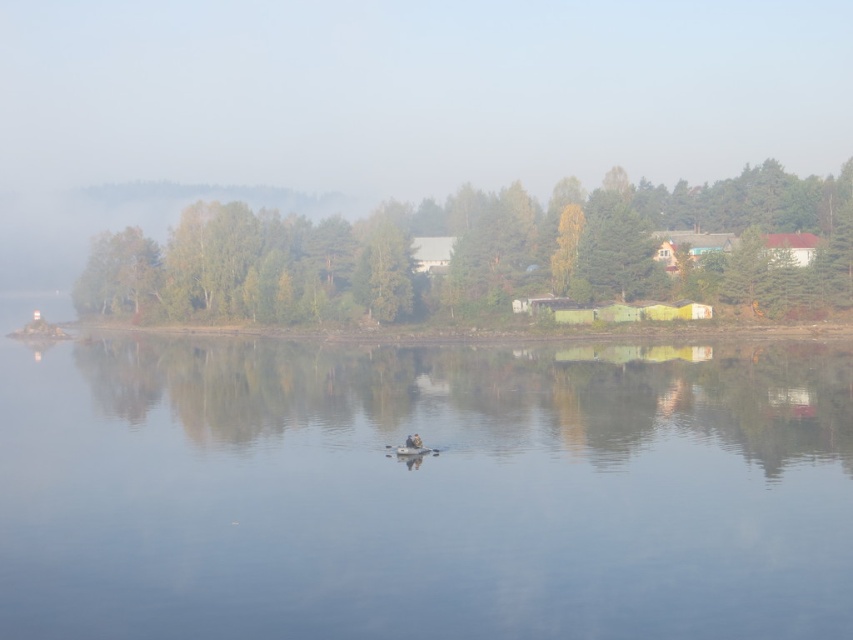
You are standing on the lakeside dock and see the transparent water at center and the green matte tree at center. Which object is closer to you?

The transparent water at center is closer to you because it is positioned in front of the green matte tree at center.

You are standing on the lakeside dock and see the transparent water at center and the green matte tree at center. Which object appears taller in the scene?

The green matte tree at center appears taller than the transparent water at center in the scene.